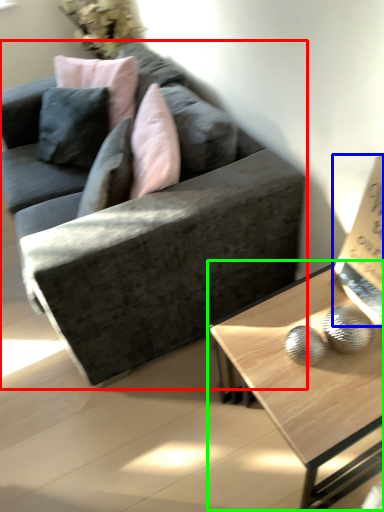
Question: Based on their relative distances, which object is farther from studio couch (highlighted by a red box)? Choose from paperback book (highlighted by a blue box) and coffee table (highlighted by a green box).

Choices:
 (A) paperback book
 (B) coffee table

Answer: (A)